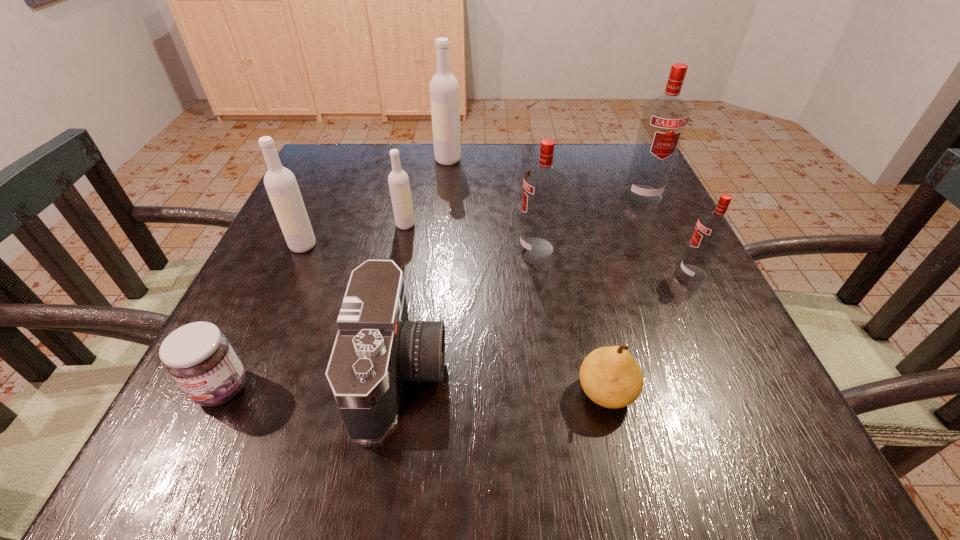
Locate which vodka is the fifth closest to the smallest red vodka. Please provide its 2D coordinates. Your answer should be formatted as a tuple, i.e. [(x, y)], where the tuple contains the x and y coordinates of a point satisfying the conditions above.

[(280, 183)]

Locate an element on the screen. The width and height of the screenshot is (960, 540). white vodka that can be found as the third closest to the smallest red vodka is located at coordinates [280, 183].

Image resolution: width=960 pixels, height=540 pixels. What are the coordinates of `the second closest white vodka to the nearest white vodka` in the screenshot? It's located at tap(444, 89).

The image size is (960, 540). I want to click on red vodka object that ranks as the second closest to the eighth nearest object, so click(543, 184).

You are a GUI agent. You are given a task and a screenshot of the screen. Output one action in this format:
    pyautogui.click(x=<x>, y=<y>)
    Task: Click on the second closest red vodka to the leftmost white vodka
    The height and width of the screenshot is (540, 960).
    Given the screenshot: What is the action you would take?
    pyautogui.click(x=664, y=119)

This screenshot has height=540, width=960. What are the coordinates of `free space in the image that satisfies the following two spatial constraints: 1. on the front-facing side of the pear; 2. on the right side of the camera` in the screenshot? It's located at (397, 393).

The width and height of the screenshot is (960, 540). I want to click on free space that satisfies the following two spatial constraints: 1. on the front-facing side of the camera; 2. on the back side of the pear, so click(397, 393).

Where is `free space that satisfies the following two spatial constraints: 1. on the front label of the second farthest vodka; 2. on the front-facing side of the black camera`? This screenshot has width=960, height=540. free space that satisfies the following two spatial constraints: 1. on the front label of the second farthest vodka; 2. on the front-facing side of the black camera is located at coordinates (726, 373).

Find the location of a particular element. The width and height of the screenshot is (960, 540). vacant point that satisfies the following two spatial constraints: 1. on the back side of the pear; 2. on the front label of the third vodka from right to left is located at coordinates (572, 248).